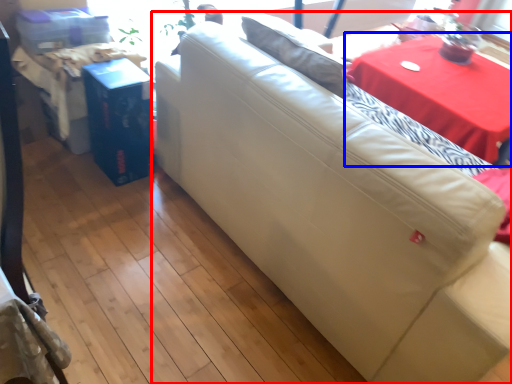
Question: Among these objects, which one is farthest to the camera, studio couch (highlighted by a red box) or table (highlighted by a blue box)?

Choices:
 (A) studio couch
 (B) table

Answer: (B)